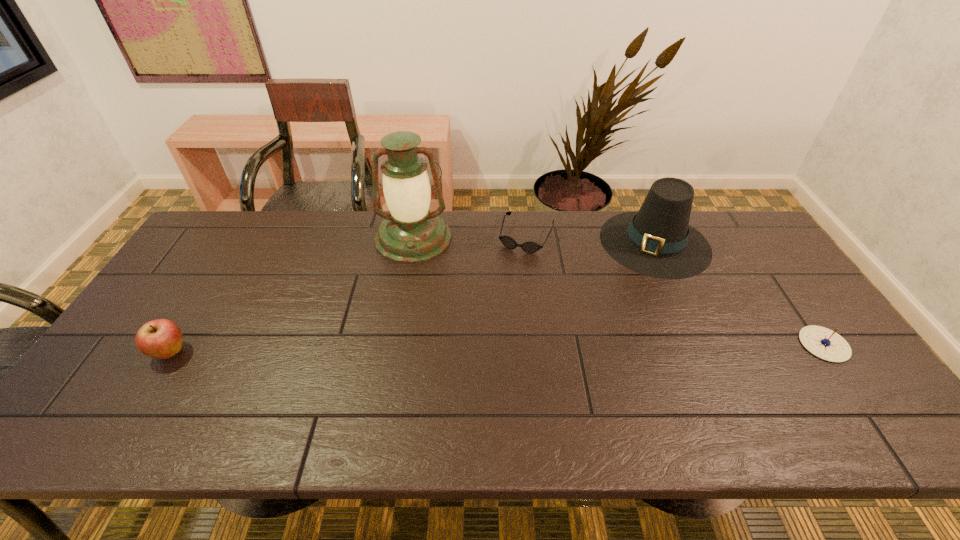
Image resolution: width=960 pixels, height=540 pixels. I want to click on vacant region located 0.260m on the back of the apple, so click(222, 270).

Image resolution: width=960 pixels, height=540 pixels. I want to click on free space located on the left of the compass, so click(x=685, y=345).

I want to click on vacant space situated 0.320m with the light compartment facing forward on the lantern, so click(x=406, y=347).

This screenshot has width=960, height=540. I want to click on vacant space located 0.230m with the light compartment facing forward on the lantern, so click(x=408, y=320).

Identify the location of free spot located with the light compartment facing forward on the lantern. This screenshot has height=540, width=960. (407, 338).

Identify the location of vacant space located 0.220m on the lenses of the shortest object. (498, 301).

Image resolution: width=960 pixels, height=540 pixels. Find the location of `free space located 0.210m on the lenses of the shortest object`. free space located 0.210m on the lenses of the shortest object is located at coordinates (499, 299).

Image resolution: width=960 pixels, height=540 pixels. Find the location of `free region located 0.060m on the lenses of the shortest object`. free region located 0.060m on the lenses of the shortest object is located at coordinates (514, 266).

Locate an element on the screen. The height and width of the screenshot is (540, 960). vacant space located on the front-facing side of the fourth object from left to right is located at coordinates (606, 309).

What are the coordinates of `free space located 0.400m on the front-facing side of the fourth object from left to right` in the screenshot? It's located at (569, 359).